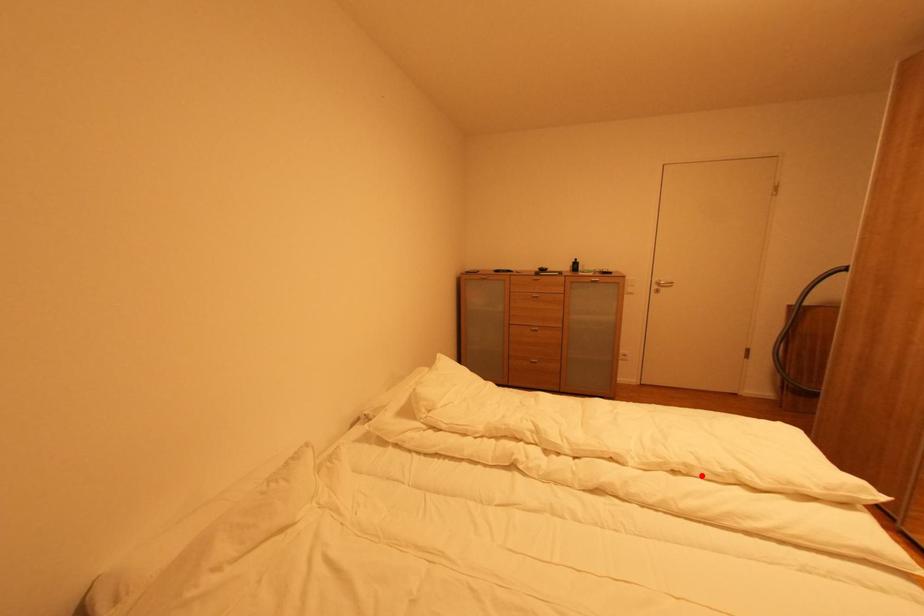
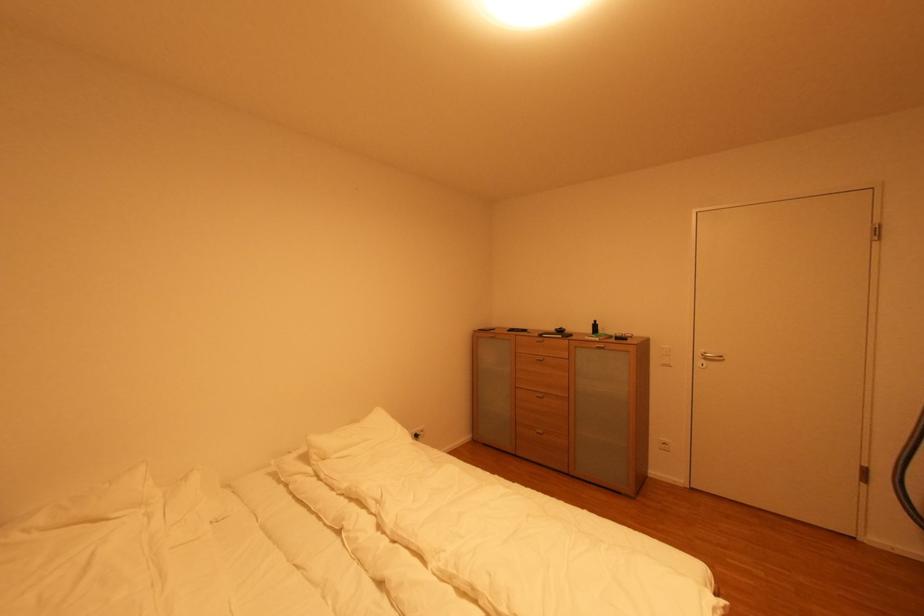
Locate, in the second image, the point that corresponds to the highlighted location in the first image.

(485, 606)